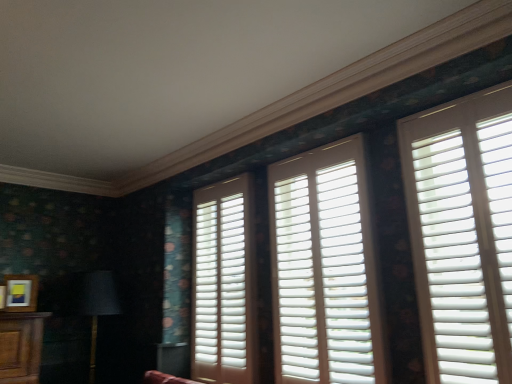
Question: Is white matte shutters at right, acting as the first window starting from the right, oriented away from matte black lampshade at left?

Choices:
 (A) yes
 (B) no

Answer: (B)

Question: Considering the relative positions of white matte shutters at right, acting as the first window starting from the right, and matte black lampshade at left in the image provided, is white matte shutters at right, acting as the first window starting from the right, in front of matte black lampshade at left?

Choices:
 (A) no
 (B) yes

Answer: (B)

Question: Can you confirm if white matte shutters at right, acting as the first window starting from the right, is smaller than matte black lampshade at left?

Choices:
 (A) yes
 (B) no

Answer: (A)

Question: Can you confirm if white matte shutters at right, arranged as the third window when viewed from the left, is shorter than matte black lampshade at left?

Choices:
 (A) yes
 (B) no

Answer: (B)

Question: Considering the relative sizes of white matte shutters at right, acting as the first window starting from the right, and matte black lampshade at left in the image provided, is white matte shutters at right, acting as the first window starting from the right, wider than matte black lampshade at left?

Choices:
 (A) yes
 (B) no

Answer: (B)

Question: Is matte black lampshade at left taller or shorter than matte wooden picture frame at lower left?

Choices:
 (A) short
 (B) tall

Answer: (B)

Question: Looking at the image, does matte black lampshade at left seem bigger or smaller compared to matte wooden picture frame at lower left?

Choices:
 (A) small
 (B) big

Answer: (B)

Question: Is point (91, 342) positioned closer to the camera than point (7, 299)?

Choices:
 (A) farther
 (B) closer

Answer: (A)

Question: In the image, is matte black lampshade at left positioned in front of or behind matte wooden picture frame at lower left?

Choices:
 (A) front
 (B) behind

Answer: (A)

Question: In the image, is white matte wood shutters at center, acting as the 2th window starting from the right, positioned in front of or behind matte wooden picture frame at lower left?

Choices:
 (A) behind
 (B) front

Answer: (B)

Question: Considering the positions of white matte wood shutters at center, acting as the 2th window starting from the right, and matte wooden picture frame at lower left in the image, is white matte wood shutters at center, acting as the 2th window starting from the right, wider or thinner than matte wooden picture frame at lower left?

Choices:
 (A) thin
 (B) wide

Answer: (B)

Question: Would you say white matte wood shutters at center, which is the second window in left-to-right order, is to the left or to the right of matte wooden picture frame at lower left in the picture?

Choices:
 (A) left
 (B) right

Answer: (B)

Question: From the image's perspective, is white matte wood shutters at center, acting as the 2th window starting from the right, located above or below matte wooden picture frame at lower left?

Choices:
 (A) above
 (B) below

Answer: (A)

Question: In the image, is white matte shutters at right, arranged as the third window when viewed from the left, positioned in front of or behind matte wooden picture frame at lower left?

Choices:
 (A) front
 (B) behind

Answer: (A)

Question: Is point (500, 276) closer or farther from the camera than point (14, 304)?

Choices:
 (A) closer
 (B) farther

Answer: (A)